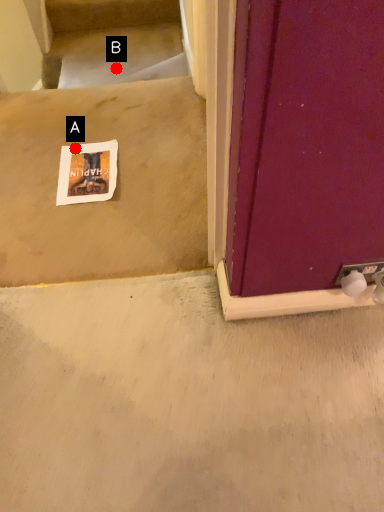
Question: Two points are circled on the image, labeled by A and B beside each circle. Among these points, which one is nearest to the camera?

Choices:
 (A) A is closer
 (B) B is closer

Answer: (A)